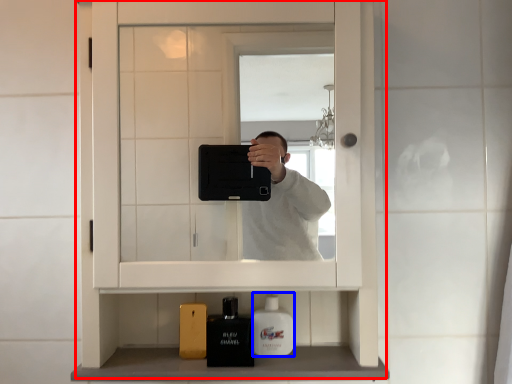
Question: Which object appears closest to the camera in this image, medicine cabinet (highlighted by a red box) or mouthwash (highlighted by a blue box)?

Choices:
 (A) medicine cabinet
 (B) mouthwash

Answer: (A)